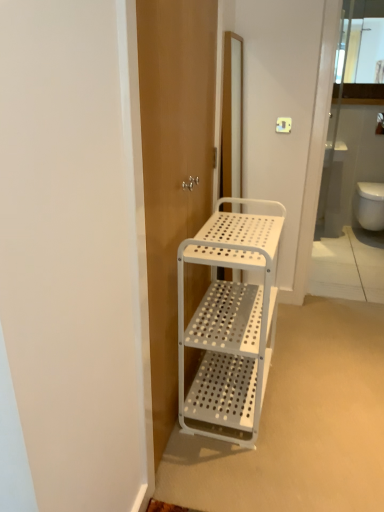
The image size is (384, 512). What are the coordinates of `vacant space to the right of white perforated screen door at center` in the screenshot? It's located at (322, 386).